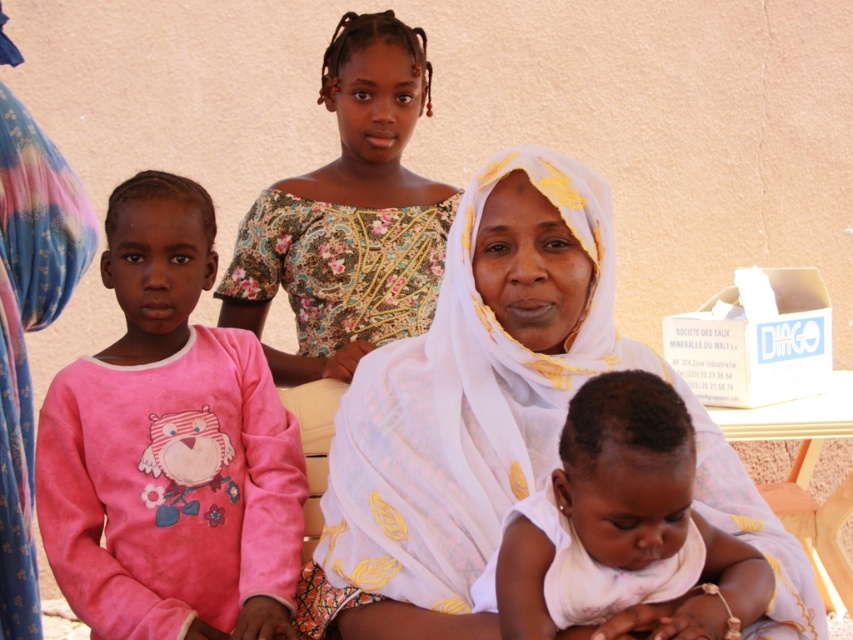
Question: Which object is farther from the camera taking this photo?

Choices:
 (A) floral fabric dress at upper center
 (B) pink fleece sweater at left

Answer: (A)

Question: Is pink fleece sweater at left below floral fabric dress at upper center?

Choices:
 (A) yes
 (B) no

Answer: (A)

Question: Does white sheer cloth at center have a greater width compared to white soft baby at center?

Choices:
 (A) no
 (B) yes

Answer: (B)

Question: Which point appears closest to the camera in this image?

Choices:
 (A) (387, 412)
 (B) (202, 452)
 (C) (347, 44)

Answer: (A)

Question: Which object is positioned farthest from the floral fabric dress at upper center?

Choices:
 (A) pink fleece sweater at left
 (B) white soft baby at center
 (C) white sheer cloth at center

Answer: (B)

Question: Does white sheer cloth at center lie in front of pink fleece sweater at left?

Choices:
 (A) no
 (B) yes

Answer: (B)